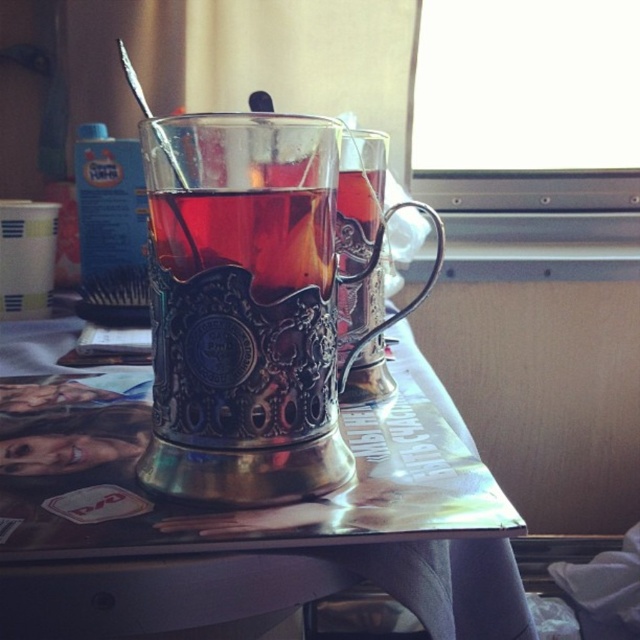
From the picture: Does shiny metallic mug at center have a lesser height compared to metallic brass table at center?

Yes.

Can you confirm if shiny metallic mug at center is positioned to the right of metallic brass table at center?

Incorrect, shiny metallic mug at center is not on the right side of metallic brass table at center.

Who is more distant from viewer, (291, 397) or (508, 634)?

Positioned behind is point (508, 634).

The width and height of the screenshot is (640, 640). I want to click on shiny metallic mug at center, so click(x=248, y=307).